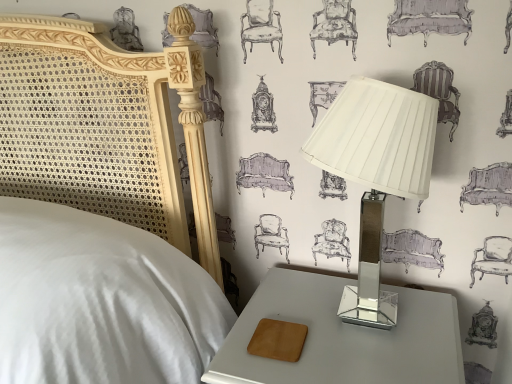
Describe the element at coordinates (375, 171) in the screenshot. I see `metallic silver lamp at right` at that location.

Locate an element on the screen. Image resolution: width=512 pixels, height=384 pixels. metallic silver lamp at right is located at coordinates (375, 171).

The height and width of the screenshot is (384, 512). What do you see at coordinates (343, 337) in the screenshot? I see `metallic gray nightstand at lower right` at bounding box center [343, 337].

Where is `metallic gray nightstand at lower right`? This screenshot has width=512, height=384. metallic gray nightstand at lower right is located at coordinates (343, 337).

In order to click on metallic silver lamp at right in this screenshot , I will do `click(375, 171)`.

In the image, is metallic silver lamp at right on the left side or the right side of metallic gray nightstand at lower right?

From the image, it's evident that metallic silver lamp at right is to the right of metallic gray nightstand at lower right.

Is the position of metallic silver lamp at right less distant than that of metallic gray nightstand at lower right?

Yes, it is in front of metallic gray nightstand at lower right.

Between point (374, 189) and point (440, 301), which one is positioned in front?

Point (374, 189)

From the image's perspective, is metallic silver lamp at right located above metallic gray nightstand at lower right?

Yes, from the image's perspective, metallic silver lamp at right is above metallic gray nightstand at lower right.

From a real-world perspective, does metallic silver lamp at right sit lower than metallic gray nightstand at lower right?

No, from a real-world perspective, metallic silver lamp at right is not under metallic gray nightstand at lower right.

Is metallic silver lamp at right wider or thinner than metallic gray nightstand at lower right?

Clearly, metallic silver lamp at right has less width compared to metallic gray nightstand at lower right.

Considering the relative sizes of metallic silver lamp at right and metallic gray nightstand at lower right in the image provided, is metallic silver lamp at right taller than metallic gray nightstand at lower right?

Correct, metallic silver lamp at right is much taller as metallic gray nightstand at lower right.

In the scene shown: Between metallic silver lamp at right and metallic gray nightstand at lower right, which one has smaller size?

metallic silver lamp at right is smaller.

Is metallic silver lamp at right inside the boundaries of metallic gray nightstand at lower right, or outside?

metallic silver lamp at right is outside metallic gray nightstand at lower right.

Is metallic silver lamp at right next to metallic gray nightstand at lower right and touching it?

No, metallic silver lamp at right is not in contact with metallic gray nightstand at lower right.

Is metallic silver lamp at right turned away from metallic gray nightstand at lower right?

No, metallic silver lamp at right's orientation is not away from metallic gray nightstand at lower right.

Can you tell me how much metallic silver lamp at right and metallic gray nightstand at lower right differ in facing direction?

The facing directions of metallic silver lamp at right and metallic gray nightstand at lower right are 3.83 degrees apart.

How distant is metallic silver lamp at right from metallic gray nightstand at lower right?

metallic silver lamp at right and metallic gray nightstand at lower right are 5.45 inches apart from each other.

The height and width of the screenshot is (384, 512). I want to click on nightstand that is on the left side of metallic silver lamp at right, so (x=343, y=337).

Which object is positioned more to the left, metallic gray nightstand at lower right or metallic silver lamp at right?

Positioned to the left is metallic gray nightstand at lower right.

Considering the positions of objects metallic gray nightstand at lower right and metallic silver lamp at right in the image provided, who is behind, metallic gray nightstand at lower right or metallic silver lamp at right?

metallic gray nightstand at lower right is behind.

Does point (446, 294) lie behind point (377, 267)?

No, (446, 294) is in front of (377, 267).

From the image's perspective, is metallic gray nightstand at lower right on metallic silver lamp at right?

No, from the image's perspective, metallic gray nightstand at lower right is not above metallic silver lamp at right.

From a real-world perspective, between metallic gray nightstand at lower right and metallic silver lamp at right, who is vertically higher?

metallic silver lamp at right, from a real-world perspective.

Is metallic gray nightstand at lower right wider than metallic silver lamp at right?

Yes.

Is metallic gray nightstand at lower right shorter than metallic silver lamp at right?

Yes, metallic gray nightstand at lower right is shorter than metallic silver lamp at right.

Considering the sizes of objects metallic gray nightstand at lower right and metallic silver lamp at right in the image provided, who is smaller, metallic gray nightstand at lower right or metallic silver lamp at right?

metallic silver lamp at right is smaller.

Would you say metallic silver lamp at right is part of metallic gray nightstand at lower right's contents?

No, metallic silver lamp at right is located outside of metallic gray nightstand at lower right.

Are metallic gray nightstand at lower right and metallic silver lamp at right far apart?

That's not correct — metallic gray nightstand at lower right is a little close to metallic silver lamp at right.

Is metallic gray nightstand at lower right facing away from metallic silver lamp at right?

metallic gray nightstand at lower right does not have its back to metallic silver lamp at right.

The height and width of the screenshot is (384, 512). Find the location of `nightstand that appears below the metallic silver lamp at right (from the image's perspective)`. nightstand that appears below the metallic silver lamp at right (from the image's perspective) is located at coordinates (343, 337).

Identify the location of nightstand behind the metallic silver lamp at right. The image size is (512, 384). (343, 337).

Where is `nightstand below the metallic silver lamp at right (from a real-world perspective)`? nightstand below the metallic silver lamp at right (from a real-world perspective) is located at coordinates (343, 337).